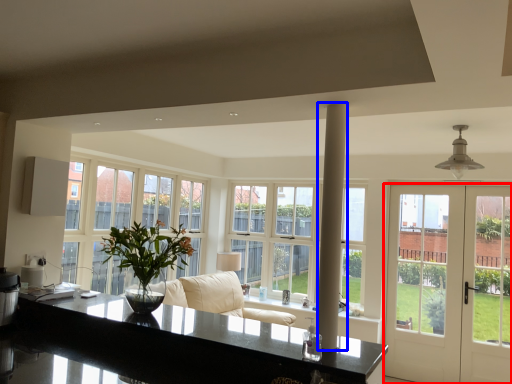
Question: Which of the following is the farthest to the observer, door (highlighted by a red box) or pillar (highlighted by a blue box)?

Choices:
 (A) door
 (B) pillar

Answer: (A)